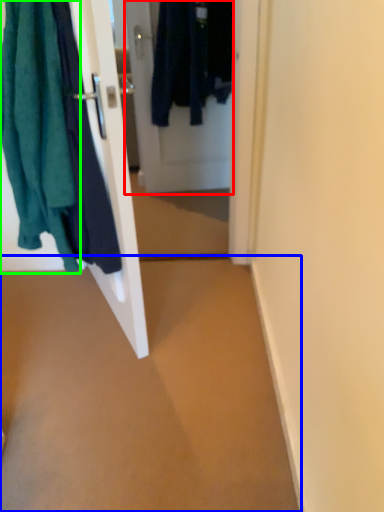
Question: Which is farther away from door (highlighted by a red box)? plain (highlighted by a blue box) or towel (highlighted by a green box)?

Choices:
 (A) plain
 (B) towel

Answer: (A)